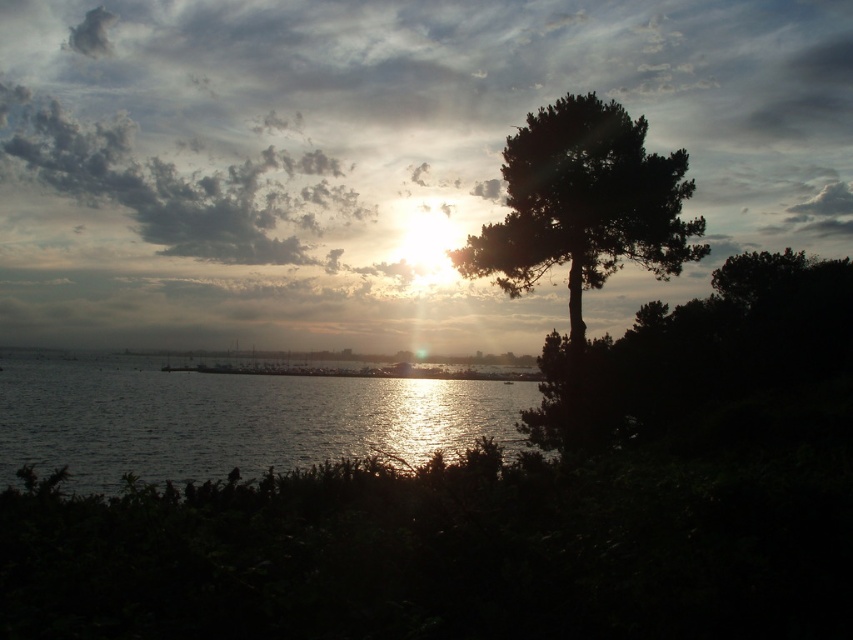
Does glistening water at center appear over dark green leafy tree at right?

No.

Is glistening water at center to the left of dark green leafy tree at right from the viewer's perspective?

Yes, glistening water at center is to the left of dark green leafy tree at right.

Locate an element on the screen. This screenshot has height=640, width=853. glistening water at center is located at coordinates (231, 419).